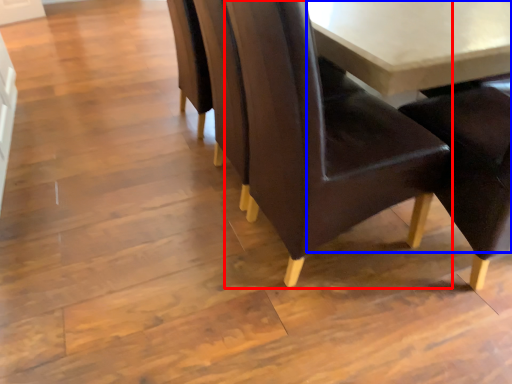
Question: Which object appears farthest to the camera in this image, chair (highlighted by a red box) or table (highlighted by a blue box)?

Choices:
 (A) chair
 (B) table

Answer: (B)